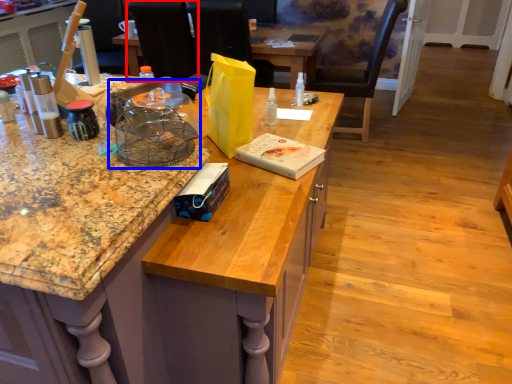
Question: Which object appears closest to the camera in this image, armchair (highlighted by a red box) or bird cage (highlighted by a blue box)?

Choices:
 (A) armchair
 (B) bird cage

Answer: (B)